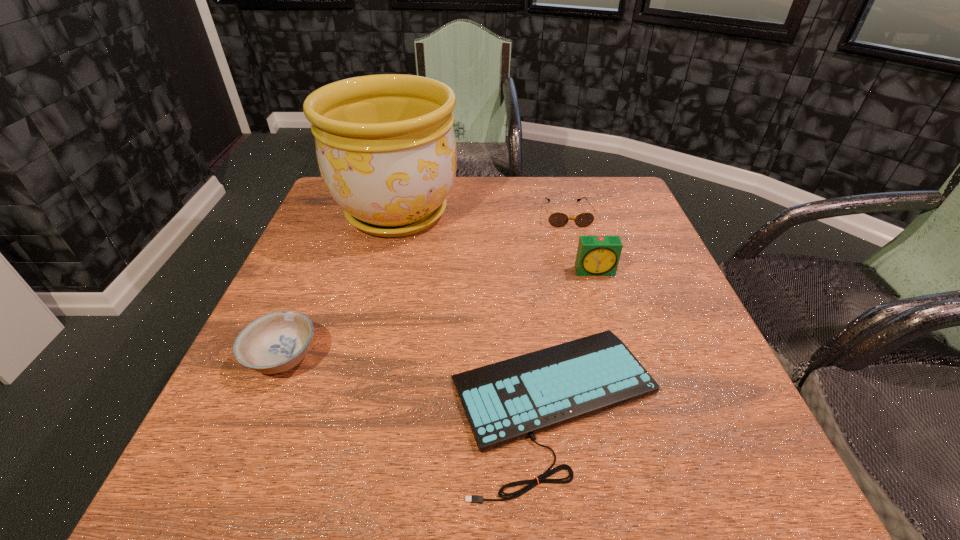
Image resolution: width=960 pixels, height=540 pixels. I want to click on the tallest object, so click(385, 144).

At what (x,y) coordinates should I click in order to perform the action: click on the third farthest object. Please return your answer as a coordinate pair (x, y). Looking at the image, I should click on (596, 255).

Locate an element on the screen. The width and height of the screenshot is (960, 540). alarm clock is located at coordinates (596, 255).

Where is `the third shortest object`? This screenshot has width=960, height=540. the third shortest object is located at coordinates (276, 342).

Where is `sunglasses`? sunglasses is located at coordinates (557, 219).

Identify the location of the shortest object. 506,401.

The image size is (960, 540). I want to click on free space located on the front of the tallest object, so click(351, 389).

Where is `vacant point located 0.210m on the front-facing side of the alarm clock`? The image size is (960, 540). vacant point located 0.210m on the front-facing side of the alarm clock is located at coordinates (619, 348).

Locate an element on the screen. Image resolution: width=960 pixels, height=540 pixels. vacant area situated 0.360m on the right of the bowl is located at coordinates (510, 357).

Where is `vacant area situated 0.060m on the lenses of the sunglasses`? vacant area situated 0.060m on the lenses of the sunglasses is located at coordinates (574, 242).